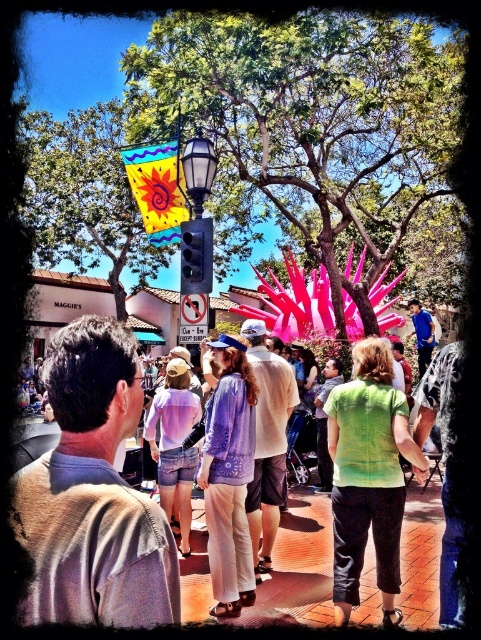
You are standing at the edge of the crowd and see a person wearing a pastel tie dye shirt at center. If you walk straight towards them, will you first encounter the point at coordinates (93, 550)?

Yes, the point at coordinates (93, 550) is on the pastel tie dye shirt at center, so walking straight towards them would first encounter that point.